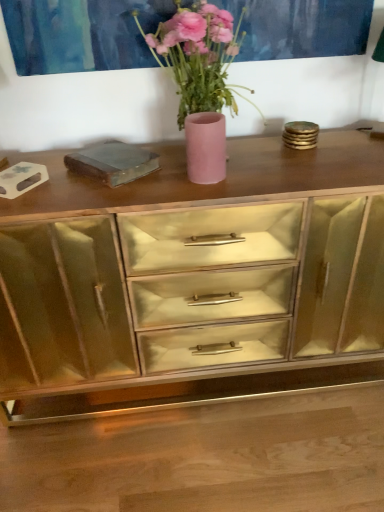
You are a GUI agent. You are given a task and a screenshot of the screen. Output one action in this format:
    pyautogui.click(x=<x>, y=<y>)
    Task: Click on the pink matte vase at center
    
    Given the screenshot: What is the action you would take?
    pyautogui.click(x=199, y=56)

Locate an element on the screen. matte pink vase at center is located at coordinates (206, 147).

At what (x,y) coordinates should I click in order to perform the action: click on pink matte vase at center. Please return your answer as a coordinate pair (x, y). The width and height of the screenshot is (384, 512). Looking at the image, I should click on (199, 56).

Can you confirm if matte pink vase at center is bigger than gold mirrored cabinet at center?

Actually, matte pink vase at center might be smaller than gold mirrored cabinet at center.

From the picture: From the image's perspective, is matte pink vase at center beneath gold mirrored cabinet at center?

No, from the image's perspective, matte pink vase at center is not beneath gold mirrored cabinet at center.

Is matte pink vase at center facing away from gold mirrored cabinet at center?

matte pink vase at center is not turned away from gold mirrored cabinet at center.

Is point (217, 144) farther from camera compared to point (89, 357)?

No, it is not.

Based on the photo, considering the relative sizes of pink matte vase at center and matte pink vase at center in the image provided, is pink matte vase at center bigger than matte pink vase at center?

Indeed, pink matte vase at center has a larger size compared to matte pink vase at center.

Considering the sizes of objects pink matte vase at center and matte pink vase at center in the image provided, who is shorter, pink matte vase at center or matte pink vase at center?

matte pink vase at center.

Is pink matte vase at center wider than matte pink vase at center?

Yes, pink matte vase at center is wider than matte pink vase at center.

Can you tell me how much pink matte vase at center and matte pink vase at center differ in facing direction?

The angular difference between pink matte vase at center and matte pink vase at center is 2.92 degrees.

In the image, is matte pink vase at center positioned in front of or behind pink matte vase at center?

matte pink vase at center is behind pink matte vase at center.

From the image's perspective, is matte pink vase at center under pink matte vase at center?

Correct, matte pink vase at center appears lower than pink matte vase at center in the image.

Is matte pink vase at center inside or outside of pink matte vase at center?

matte pink vase at center is spatially positioned inside pink matte vase at center.

Considering the positions of points (139, 291) and (189, 147), is point (139, 291) farther from camera compared to point (189, 147)?

Yes.

Is gold mirrored cabinet at center facing away from matte pink vase at center?

gold mirrored cabinet at center does not have its back to matte pink vase at center.

Is gold mirrored cabinet at center far away from pink matte vase at center?

No, there isn't a large distance between gold mirrored cabinet at center and pink matte vase at center.

Is gold mirrored cabinet at center behind pink matte vase at center?

Yes, gold mirrored cabinet at center is further from the camera.

Can you confirm if gold mirrored cabinet at center is taller than pink matte vase at center?

Yes, gold mirrored cabinet at center is taller than pink matte vase at center.

Based on their sizes in the image, would you say gold mirrored cabinet at center is bigger or smaller than pink matte vase at center?

In the image, gold mirrored cabinet at center appears to be larger than pink matte vase at center.

Is pink matte vase at center not inside gold mirrored cabinet at center?

Indeed, pink matte vase at center is completely outside gold mirrored cabinet at center.

Considering the points (229, 33) and (197, 348), which point is behind, point (229, 33) or point (197, 348)?

The point (197, 348) is farther.

In order to click on floral arrangement that is on the left side of gold mirrored cabinet at center in this screenshot , I will do `click(199, 56)`.

Is pink matte vase at center positioned far away from gold mirrored cabinet at center?

pink matte vase at center is near gold mirrored cabinet at center, not far away.

Where is `the chest of drawers beneath the matte pink vase at center (from a real-world perspective)`? The image size is (384, 512). the chest of drawers beneath the matte pink vase at center (from a real-world perspective) is located at coordinates (193, 281).

What are the coordinates of `floral arrangement that appears in front of the matte pink vase at center` in the screenshot? It's located at (199, 56).

When comparing their distances from matte pink vase at center, does gold mirrored cabinet at center or pink matte vase at center seem further?

Among the two, gold mirrored cabinet at center is located further to matte pink vase at center.

Based on their spatial positions, is matte pink vase at center or pink matte vase at center further from gold mirrored cabinet at center?

pink matte vase at center.

Considering their positions, is gold mirrored cabinet at center positioned further to pink matte vase at center than matte pink vase at center?

gold mirrored cabinet at center is further to pink matte vase at center.

Looking at the image, which one is located closer to pink matte vase at center, matte pink vase at center or gold mirrored cabinet at center?

matte pink vase at center lies closer to pink matte vase at center than the other object.

Which object lies nearer to the anchor point gold mirrored cabinet at center, pink matte vase at center or matte pink vase at center?

matte pink vase at center is closer to gold mirrored cabinet at center.

Which object lies further to the anchor point matte pink vase at center, pink matte vase at center or gold mirrored cabinet at center?

Based on the image, gold mirrored cabinet at center appears to be further to matte pink vase at center.

This screenshot has width=384, height=512. What are the coordinates of `vase between pink matte vase at center and gold mirrored cabinet at center vertically` in the screenshot? It's located at (206, 147).